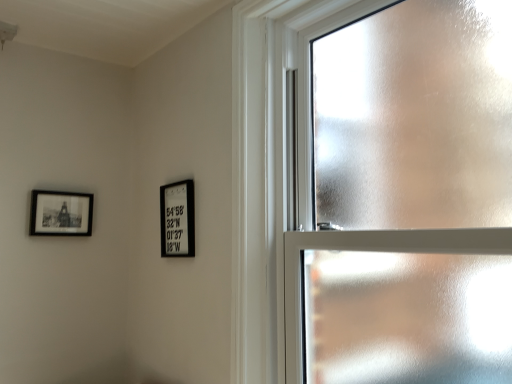
Question: Which direction should I rotate to face black matte picture frame at center, the second picture frame in the left-to-right sequence, — up or down?

Choices:
 (A) up
 (B) down

Answer: (B)

Question: Can you confirm if black matte picture frame at center, the second picture frame in the left-to-right sequence, is thinner than matte black picture frame at upper left, placed as the first picture frame when sorted from left to right?

Choices:
 (A) yes
 (B) no

Answer: (B)

Question: Is black matte picture frame at center, the first picture frame viewed from the right, not near matte black picture frame at upper left, placed as the 2th picture frame when sorted from right to left?

Choices:
 (A) yes
 (B) no

Answer: (B)

Question: From a real-world perspective, is black matte picture frame at center, the first picture frame viewed from the right, under matte black picture frame at upper left, placed as the first picture frame when sorted from left to right?

Choices:
 (A) yes
 (B) no

Answer: (A)

Question: From the image's perspective, is black matte picture frame at center, the second picture frame in the left-to-right sequence, below matte black picture frame at upper left, placed as the first picture frame when sorted from left to right?

Choices:
 (A) yes
 (B) no

Answer: (A)

Question: Does black matte picture frame at center, the second picture frame in the left-to-right sequence, have a greater height compared to matte black picture frame at upper left, placed as the 2th picture frame when sorted from right to left?

Choices:
 (A) no
 (B) yes

Answer: (B)

Question: Can you confirm if black matte picture frame at center, the first picture frame viewed from the right, is shorter than matte black picture frame at upper left, placed as the first picture frame when sorted from left to right?

Choices:
 (A) no
 (B) yes

Answer: (A)

Question: Does matte black picture frame at upper left, placed as the first picture frame when sorted from left to right, lie behind frosted glass window at upper right?

Choices:
 (A) no
 (B) yes

Answer: (B)

Question: From a real-world perspective, is matte black picture frame at upper left, placed as the first picture frame when sorted from left to right, positioned over frosted glass window at upper right based on gravity?

Choices:
 (A) no
 (B) yes

Answer: (A)

Question: Is matte black picture frame at upper left, placed as the 2th picture frame when sorted from right to left, smaller than frosted glass window at upper right?

Choices:
 (A) yes
 (B) no

Answer: (A)

Question: Is the depth of matte black picture frame at upper left, placed as the 2th picture frame when sorted from right to left, less than that of frosted glass window at upper right?

Choices:
 (A) no
 (B) yes

Answer: (A)

Question: Considering the relative positions of matte black picture frame at upper left, placed as the 2th picture frame when sorted from right to left, and frosted glass window at upper right in the image provided, is matte black picture frame at upper left, placed as the 2th picture frame when sorted from right to left, to the right of frosted glass window at upper right from the viewer's perspective?

Choices:
 (A) yes
 (B) no

Answer: (B)

Question: From the image's perspective, is matte black picture frame at upper left, placed as the 2th picture frame when sorted from right to left, over frosted glass window at upper right?

Choices:
 (A) no
 (B) yes

Answer: (A)

Question: From the image's perspective, is frosted glass window at upper right above matte black picture frame at upper left, placed as the 2th picture frame when sorted from right to left?

Choices:
 (A) yes
 (B) no

Answer: (A)